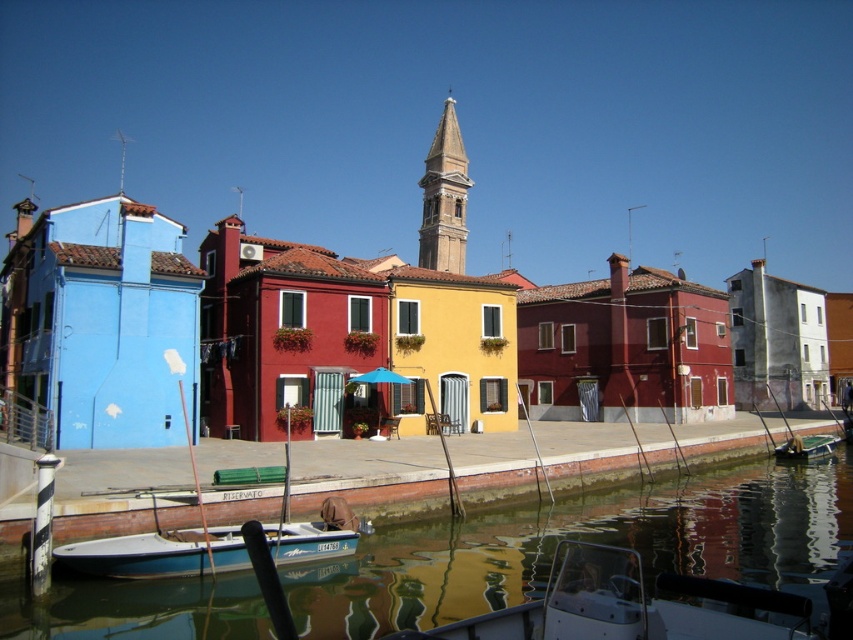
Question: Is smooth concrete dock at center bigger than smooth stone bell tower at center?

Choices:
 (A) yes
 (B) no

Answer: (B)

Question: Which point is closer to the camera?

Choices:
 (A) (74, 586)
 (B) (691, 586)
 (C) (9, 504)

Answer: (B)

Question: Is smooth concrete dock at center wider than green plastic boat at center?

Choices:
 (A) yes
 (B) no

Answer: (A)

Question: Which point appears farthest from the camera in this image?

Choices:
 (A) (424, 528)
 (B) (787, 600)
 (C) (833, 436)

Answer: (C)

Question: Does white glossy boat at lower left come in front of smooth stone bell tower at center?

Choices:
 (A) yes
 (B) no

Answer: (A)

Question: Which object appears farthest from the camera in this image?

Choices:
 (A) smooth concrete dock at center
 (B) greenish reflective water at lower center
 (C) green plastic boat at center
 (D) white glossy boat at lower left

Answer: (C)